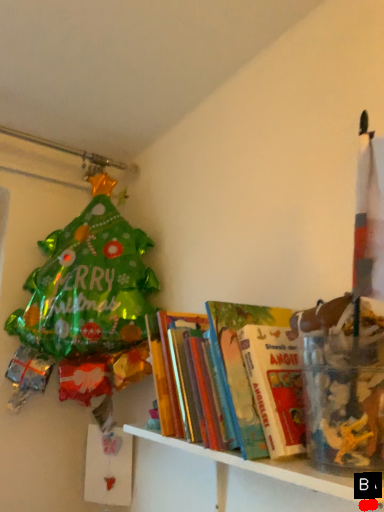
Question: Two points are circled on the image, labeled by A and B beside each circle. Among these points, which one is farthest from the camera?

Choices:
 (A) A is further
 (B) B is further

Answer: (B)